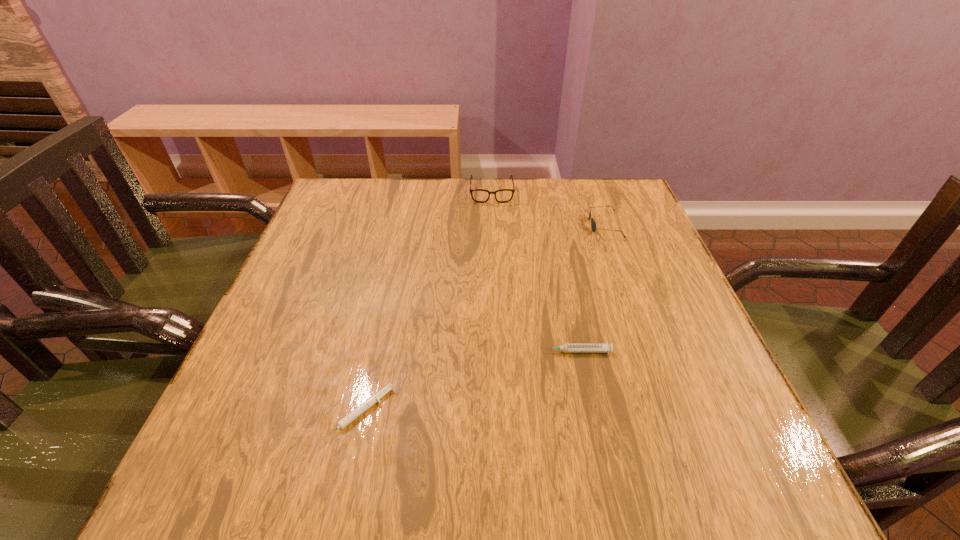
Where is `object located in the far right corner section of the desktop`? The height and width of the screenshot is (540, 960). object located in the far right corner section of the desktop is located at coordinates (593, 225).

At what (x,y) coordinates should I click in order to perform the action: click on free spot at the far edge of the desktop. Please return your answer as a coordinate pair (x, y). This screenshot has height=540, width=960. Looking at the image, I should click on (483, 188).

You are a GUI agent. You are given a task and a screenshot of the screen. Output one action in this format:
    pyautogui.click(x=<x>, y=<y>)
    Task: Click on the vacant space at the near edge of the desktop
    
    Given the screenshot: What is the action you would take?
    pyautogui.click(x=649, y=468)

Where is `vacant area at the right edge of the desktop`? This screenshot has height=540, width=960. vacant area at the right edge of the desktop is located at coordinates (718, 414).

In the image, there is a desktop. Identify the location of vacant space at the far left corner. (319, 213).

The height and width of the screenshot is (540, 960). I want to click on vacant position at the near left corner of the desktop, so click(203, 481).

This screenshot has width=960, height=540. In the image, there is a desktop. In order to click on free space at the far right corner in this screenshot , I will do `click(627, 224)`.

At what (x,y) coordinates should I click in order to perform the action: click on vacant space at the near right corner of the desktop. Please return your answer as a coordinate pair (x, y). This screenshot has height=540, width=960. Looking at the image, I should click on (690, 451).

At what (x,y) coordinates should I click in order to perform the action: click on free space between the second nearest object and the tallest object. Please return your answer as a coordinate pair (x, y). This screenshot has width=960, height=540. Looking at the image, I should click on (534, 272).

Identify the location of vacant space that's between the rightmost object and the second shortest object. The height and width of the screenshot is (540, 960). (589, 288).